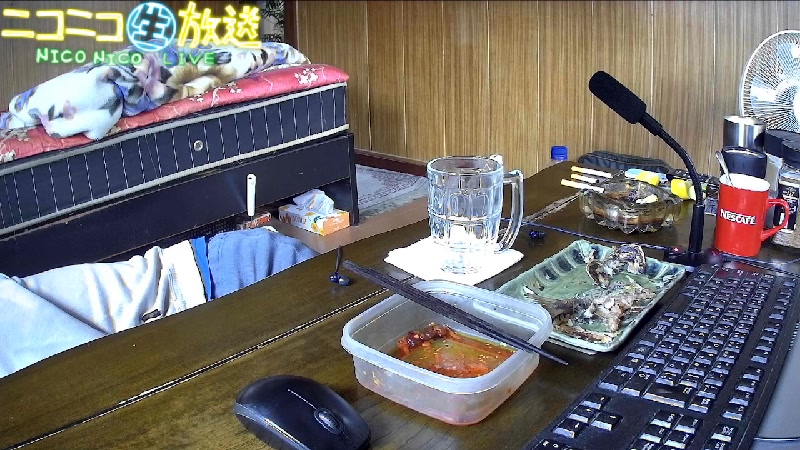
Image resolution: width=800 pixels, height=450 pixels. Identify the location of glass. (456, 223).